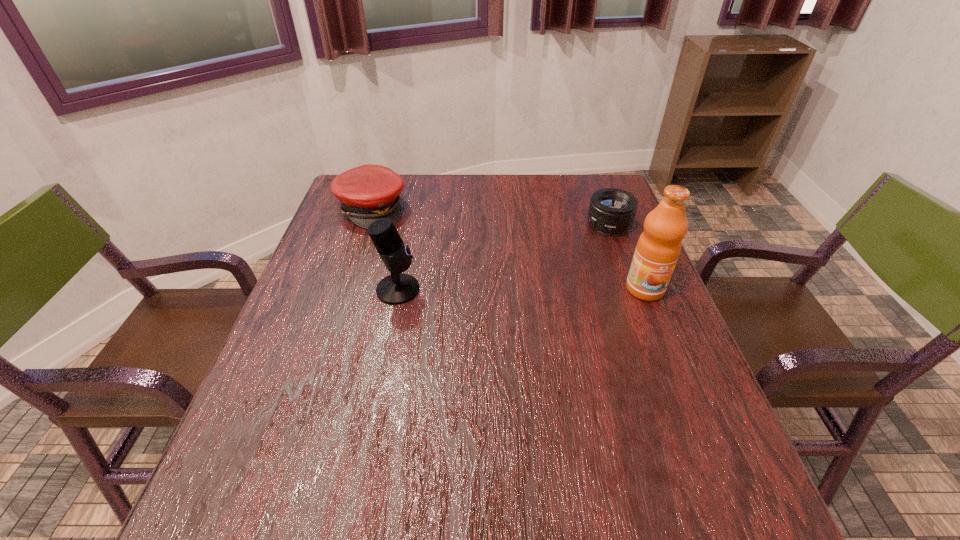
This screenshot has width=960, height=540. I want to click on free space on the desktop that is between the third shortest object and the fruit juice and is positioned on the front of the second shortest object with an emblem, so click(514, 289).

Where is `vacant spot on the desktop that is between the second tallest object and the fruit juice and is positioned on the side of the shortest object with brand markings and control switches`? This screenshot has height=540, width=960. vacant spot on the desktop that is between the second tallest object and the fruit juice and is positioned on the side of the shortest object with brand markings and control switches is located at coordinates (494, 289).